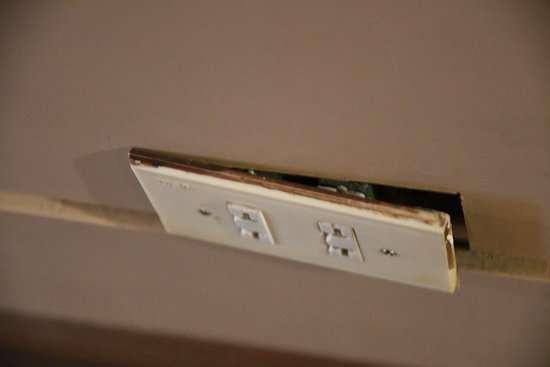
At what (x,y) coordinates should I click in order to perform the action: click on wall to right of cover wall to left of cover. Please return your answer as a coordinate pair (x, y). The width and height of the screenshot is (550, 367). Looking at the image, I should click on (493, 217), (101, 167).